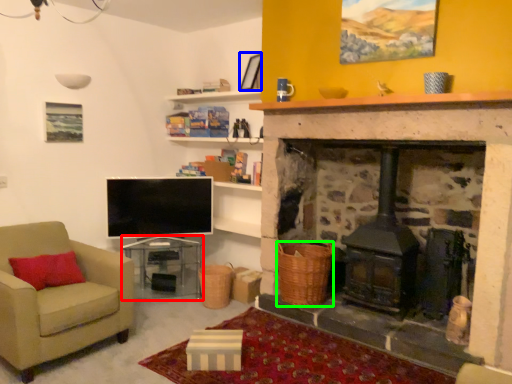
Question: Based on their relative distances, which object is nearer to table (highlighted by a red box)? Choose from picture frame (highlighted by a blue box) and basket (highlighted by a green box).

Choices:
 (A) picture frame
 (B) basket

Answer: (B)